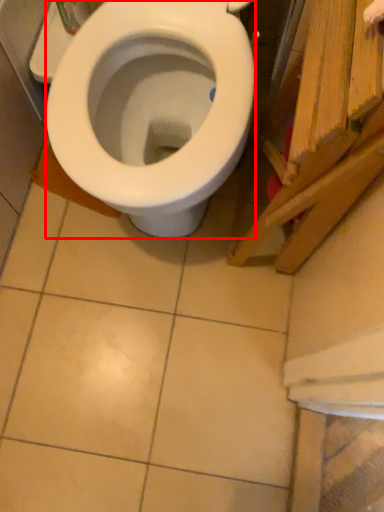
Question: Where is bidet (annotated by the red box) located in relation to wood in the image?

Choices:
 (A) left
 (B) right

Answer: (A)